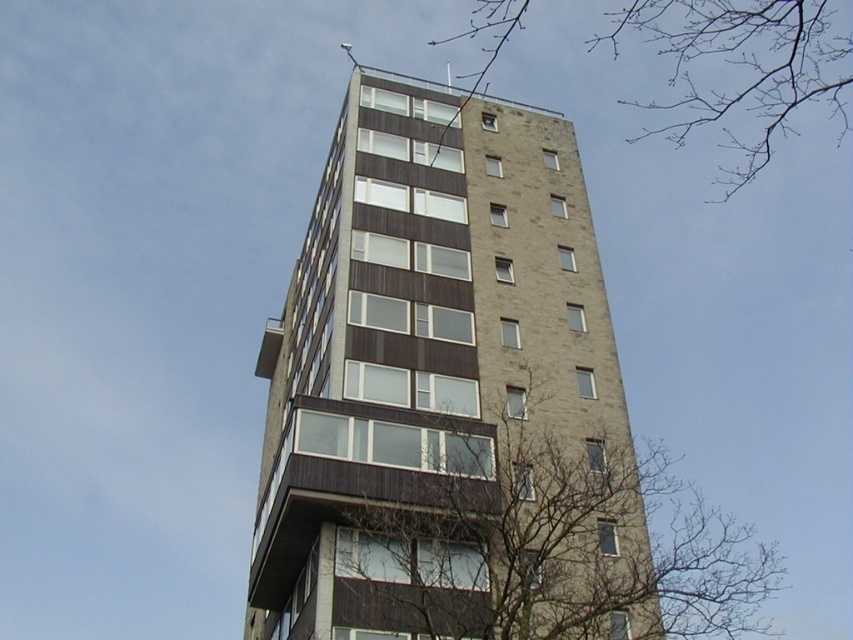
Question: Which of the following is the farthest from the observer?

Choices:
 (A) brown brick building at center
 (B) brown leafless branches at lower center

Answer: (B)

Question: Does brown leafless branches at lower center have a lesser width compared to bare branches at upper center?

Choices:
 (A) yes
 (B) no

Answer: (A)

Question: Which object is closer to the camera taking this photo?

Choices:
 (A) brown brick building at center
 (B) brown leafless branches at lower center

Answer: (A)

Question: Can you confirm if brown leafless branches at lower center is positioned above bare branches at upper center?

Choices:
 (A) no
 (B) yes

Answer: (A)

Question: Does brown brick building at center appear on the left side of brown leafless branches at lower center?

Choices:
 (A) yes
 (B) no

Answer: (A)

Question: Which is nearer to the brown leafless branches at lower center?

Choices:
 (A) brown brick building at center
 (B) bare branches at upper center

Answer: (A)